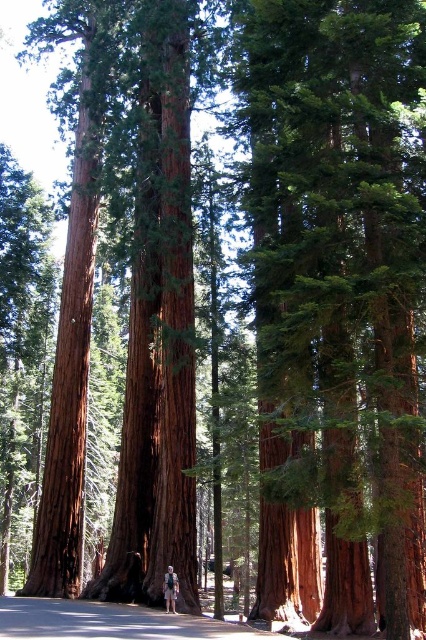
Does smooth reddish-brown tree trunk at center appear under tan leather jacket at center?

No, smooth reddish-brown tree trunk at center is not below tan leather jacket at center.

Does smooth reddish-brown tree trunk at center have a lesser height compared to tan leather jacket at center?

In fact, smooth reddish-brown tree trunk at center may be taller than tan leather jacket at center.

The height and width of the screenshot is (640, 426). Find the location of `smooth reddish-brown tree trunk at center`. smooth reddish-brown tree trunk at center is located at coordinates (340, 280).